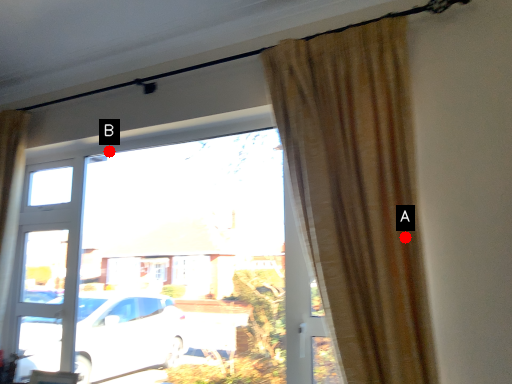
Question: Two points are circled on the image, labeled by A and B beside each circle. Which point is further to the camera?

Choices:
 (A) A is further
 (B) B is further

Answer: (B)